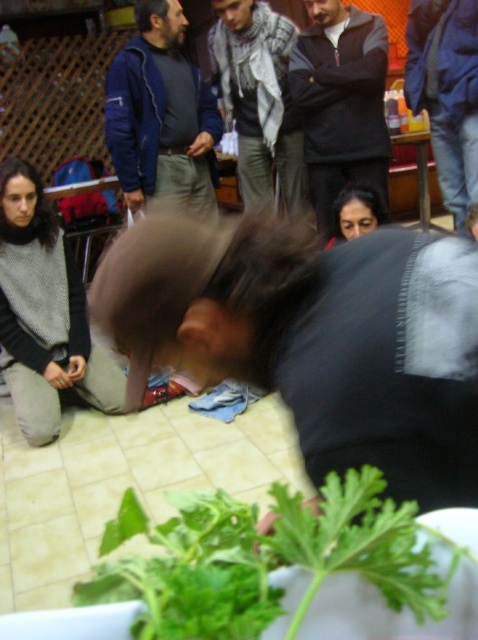
From the picture: How distant is green leafy plant at lower center from dark gray sweater at center?

green leafy plant at lower center is 2.63 meters away from dark gray sweater at center.

Consider the image. Who is lower down, green leafy plant at lower center or dark gray sweater at center?

Positioned lower is green leafy plant at lower center.

This screenshot has width=478, height=640. What are the coordinates of `green leafy plant at lower center` in the screenshot? It's located at (265, 560).

Is point (41, 236) positioned in front of point (142, 42)?

Yes.

Which is behind, point (23, 211) or point (174, 129)?

Point (174, 129)

Between point (61, 301) and point (173, 129), which one is positioned in front?

Positioned in front is point (61, 301).

This screenshot has height=640, width=478. I want to click on knit sweater at lower left, so click(44, 314).

Does green leafy plant at lower center appear on the left side of knit sweater at lower left?

In fact, green leafy plant at lower center is to the right of knit sweater at lower left.

Between point (241, 515) and point (12, 403), which one is positioned in front?

Point (241, 515) is more forward.

At what (x,y) coordinates should I click in order to perform the action: click on green leafy plant at lower center. Please return your answer as a coordinate pair (x, y). This screenshot has height=640, width=478. Looking at the image, I should click on (265, 560).